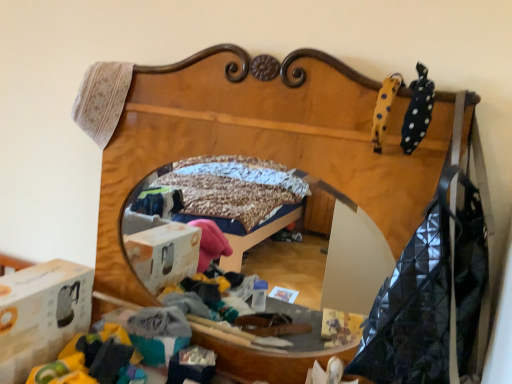
Find the location of `black dotted fabric at upper right`. black dotted fabric at upper right is located at coordinates (417, 111).

Measure the distance between point (227, 112) and camera.

The depth of point (227, 112) is 1.06 meters.

Describe the element at coordinates (384, 109) in the screenshot. I see `yellow dotted plush at upper right` at that location.

At what (x,y) coordinates should I click in order to perform the action: click on black dotted fabric at upper right. Please return your answer as a coordinate pair (x, y). Looking at the image, I should click on (417, 111).

Is wooden bed frame at center beside yellow dotted plush at upper right?

No.

I want to click on furniture below the yellow dotted plush at upper right (from the image's perspective), so click(x=262, y=139).

Considering the relative sizes of wooden bed frame at center and yellow dotted plush at upper right in the image provided, is wooden bed frame at center smaller than yellow dotted plush at upper right?

Incorrect, wooden bed frame at center is not smaller in size than yellow dotted plush at upper right.

Which is more distant, (389, 99) or (40, 364)?

Point (40, 364)

What's the angular difference between yellow dotted plush at upper right and white cardboard box at lower left's facing directions?

They differ by 0.316 degrees in their facing directions.

From a real-world perspective, does yellow dotted plush at upper right sit lower than white cardboard box at lower left?

Actually, yellow dotted plush at upper right is physically above white cardboard box at lower left in the real world.

Considering the relative sizes of yellow dotted plush at upper right and white cardboard box at lower left in the image provided, is yellow dotted plush at upper right bigger than white cardboard box at lower left?

Incorrect, yellow dotted plush at upper right is not larger than white cardboard box at lower left.

Which of these two, white cardboard box at lower left or wooden bed frame at center, stands shorter?

With less height is white cardboard box at lower left.

Is white cardboard box at lower left beside wooden bed frame at center?

No, white cardboard box at lower left is not beside wooden bed frame at center.

This screenshot has height=384, width=512. What are the coordinates of `furniture that appears above the white cardboard box at lower left (from a real-world perspective)` in the screenshot? It's located at (262, 139).

Looking at this image, which object is more forward, white cardboard box at lower left or wooden bed frame at center?

wooden bed frame at center.

Which object is closer to the camera taking this photo, yellow dotted plush at upper right or wooden bed frame at center?

Positioned in front is wooden bed frame at center.

From the image's perspective, between yellow dotted plush at upper right and wooden bed frame at center, who is located below?

wooden bed frame at center is shown below in the image.

Is yellow dotted plush at upper right bigger or smaller than wooden bed frame at center?

yellow dotted plush at upper right is smaller than wooden bed frame at center.

Can you confirm if wooden bed frame at center is bigger than black dotted fabric at upper right?

Indeed, wooden bed frame at center has a larger size compared to black dotted fabric at upper right.

From the image's perspective, is wooden bed frame at center on black dotted fabric at upper right?

Incorrect, from the image's perspective, wooden bed frame at center is lower than black dotted fabric at upper right.

Between wooden bed frame at center and black dotted fabric at upper right, which one appears on the right side from the viewer's perspective?

Positioned to the right is black dotted fabric at upper right.

Is black dotted fabric at upper right wider or thinner than yellow dotted plush at upper right?

Considering their sizes, black dotted fabric at upper right looks broader than yellow dotted plush at upper right.

From a real-world perspective, is black dotted fabric at upper right positioned above or below yellow dotted plush at upper right?

In terms of real-world spatial position, black dotted fabric at upper right is above yellow dotted plush at upper right.

Considering the positions of point (426, 89) and point (385, 84), is point (426, 89) closer or farther from the camera than point (385, 84)?

Point (426, 89) appears to be closer to the viewer than point (385, 84).

Looking at this image, does wooden bed frame at center have a greater height compared to white cardboard box at lower left?

Indeed, wooden bed frame at center has a greater height compared to white cardboard box at lower left.

Is wooden bed frame at center not close to white cardboard box at lower left?

wooden bed frame at center is actually quite close to white cardboard box at lower left.

Can you confirm if wooden bed frame at center is smaller than white cardboard box at lower left?

Actually, wooden bed frame at center might be larger than white cardboard box at lower left.

In order to click on toy above the wooden bed frame at center (from the image's perspective) in this screenshot , I will do `click(384, 109)`.

Locate an element on the screen. cardboard box on the left of yellow dotted plush at upper right is located at coordinates (41, 314).

Looking at the image, which one is located further to wooden bed frame at center, black dotted fabric at upper right or yellow dotted plush at upper right?

Among the two, black dotted fabric at upper right is located further to wooden bed frame at center.

From the image, which object appears to be nearer to wooden bed frame at center, yellow dotted plush at upper right or white cardboard box at lower left?

yellow dotted plush at upper right is positioned closer to the anchor wooden bed frame at center.

Which object lies nearer to the anchor point wooden bed frame at center, black dotted fabric at upper right or white cardboard box at lower left?

black dotted fabric at upper right is closer to wooden bed frame at center.

Estimate the real-world distances between objects in this image. Which object is closer to black dotted fabric at upper right, yellow dotted plush at upper right or wooden bed frame at center?

The object closer to black dotted fabric at upper right is yellow dotted plush at upper right.

Estimate the real-world distances between objects in this image. Which object is further from black dotted fabric at upper right, wooden bed frame at center or white cardboard box at lower left?

white cardboard box at lower left lies further to black dotted fabric at upper right than the other object.

From the image, which object appears to be nearer to black dotted fabric at upper right, wooden bed frame at center or yellow dotted plush at upper right?

The object closer to black dotted fabric at upper right is yellow dotted plush at upper right.

From the image, which object appears to be farther from black dotted fabric at upper right, yellow dotted plush at upper right or white cardboard box at lower left?

white cardboard box at lower left lies further to black dotted fabric at upper right than the other object.

Based on their spatial positions, is black dotted fabric at upper right or yellow dotted plush at upper right further from white cardboard box at lower left?

The object further to white cardboard box at lower left is black dotted fabric at upper right.

Locate an element on the screen. Image resolution: width=512 pixels, height=384 pixels. furniture between white cardboard box at lower left and yellow dotted plush at upper right is located at coordinates (262, 139).

The image size is (512, 384). What are the coordinates of `clothing positioned between wooden bed frame at center and yellow dotted plush at upper right from near to far` in the screenshot? It's located at (417, 111).

This screenshot has height=384, width=512. In order to click on furniture situated between white cardboard box at lower left and black dotted fabric at upper right from left to right in this screenshot , I will do [x=262, y=139].

Where is `toy between white cardboard box at lower left and black dotted fabric at upper right`? The width and height of the screenshot is (512, 384). toy between white cardboard box at lower left and black dotted fabric at upper right is located at coordinates (384, 109).